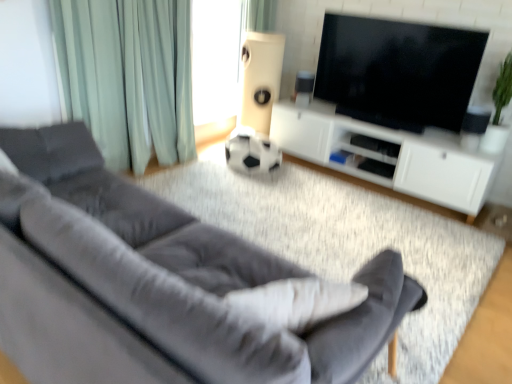
This screenshot has height=384, width=512. Identify the location of vacant space underneath black glossy tv at upper center (from a real-world perspective). (381, 125).